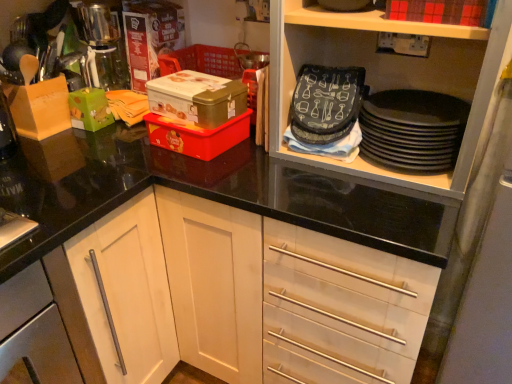
What is the approximate height of metallic gold box at center, which is counted as the second box, starting from the left?

It is 3.53 inches.

Identify the location of black matte plates at upper right. (412, 129).

Identify the location of silver metallic cabinet handle at lower left. (34, 331).

What do you see at coordinates (438, 11) in the screenshot?
I see `red matte box at upper right, which is the first box in right-to-left order` at bounding box center [438, 11].

The width and height of the screenshot is (512, 384). Find the location of `green matte box at left, which is the first box in left-to-right order`. green matte box at left, which is the first box in left-to-right order is located at coordinates (90, 109).

Can you confirm if red plastic container at center, the second box in the right-to-left sequence, is wider than green matte box at left, which ranks as the fourth box in right-to-left order?

Indeed, red plastic container at center, the second box in the right-to-left sequence, has a greater width compared to green matte box at left, which ranks as the fourth box in right-to-left order.

Would you say red plastic container at center, placed as the 3th box when sorted from left to right, contains green matte box at left, which is the first box in left-to-right order?

No, red plastic container at center, placed as the 3th box when sorted from left to right, does not contain green matte box at left, which is the first box in left-to-right order.

Is red plastic container at center, the second box in the right-to-left sequence, positioned far away from green matte box at left, which ranks as the fourth box in right-to-left order?

No, red plastic container at center, the second box in the right-to-left sequence, is not far away from green matte box at left, which ranks as the fourth box in right-to-left order.

From a real-world perspective, is red plastic container at center, the second box in the right-to-left sequence, physically located above or below green matte box at left, which ranks as the fourth box in right-to-left order?

In terms of real-world spatial position, red plastic container at center, the second box in the right-to-left sequence, is below green matte box at left, which ranks as the fourth box in right-to-left order.

Based on the photo, is metallic gold box at center, which is the third box in right-to-left order, directly adjacent to red plastic container at center, placed as the 3th box when sorted from left to right?

Yes, metallic gold box at center, which is the third box in right-to-left order, is right next to red plastic container at center, placed as the 3th box when sorted from left to right, and making contact.

Considering the positions of points (229, 97) and (161, 142), is point (229, 97) closer to camera compared to point (161, 142)?

Yes.

The image size is (512, 384). I want to click on the 2nd box above the red plastic container at center, placed as the 3th box when sorted from left to right (from a real-world perspective), so click(197, 98).

How much distance is there between metallic gold box at center, which is the third box in right-to-left order, and red plastic container at center, the second box in the right-to-left sequence?

6.49 centimeters.

Which point is more forward, (84,10) or (38,327)?

The point (38,327) is more forward.

Who is bigger, brushed metal coffee machine at upper left or silver metallic cabinet handle at lower left?

silver metallic cabinet handle at lower left.

Locate an element on the screen. This screenshot has width=512, height=384. cabinetry that is under the brushed metal coffee machine at upper left (from a real-world perspective) is located at coordinates (34, 331).

Is red plastic container at center, placed as the 3th box when sorted from left to right, shorter than brushed metal coffee machine at upper left?

Indeed, red plastic container at center, placed as the 3th box when sorted from left to right, has a lesser height compared to brushed metal coffee machine at upper left.

Considering the positions of objects red plastic container at center, placed as the 3th box when sorted from left to right, and brushed metal coffee machine at upper left in the image provided, who is more to the left, red plastic container at center, placed as the 3th box when sorted from left to right, or brushed metal coffee machine at upper left?

Positioned to the left is brushed metal coffee machine at upper left.

You are a GUI agent. You are given a task and a screenshot of the screen. Output one action in this format:
    pyautogui.click(x=<x>, y=<y>)
    Task: Click on the coffee machine on the left side of red plastic container at center, placed as the 3th box when sorted from left to right
    The width and height of the screenshot is (512, 384).
    Given the screenshot: What is the action you would take?
    102,43

Is red plastic container at center, placed as the 3th box when sorted from left to right, completely or partially outside of brushed metal coffee machine at upper left?

red plastic container at center, placed as the 3th box when sorted from left to right, lies outside brushed metal coffee machine at upper left's area.

Which of these two, green matte box at left, which is the first box in left-to-right order, or red plastic container at center, the second box in the right-to-left sequence, is bigger?

red plastic container at center, the second box in the right-to-left sequence.

Would you say red plastic container at center, placed as the 3th box when sorted from left to right, is part of green matte box at left, which ranks as the fourth box in right-to-left order,'s contents?

No, green matte box at left, which ranks as the fourth box in right-to-left order, does not contain red plastic container at center, placed as the 3th box when sorted from left to right.

Locate an element on the screen. the 2nd box to the right of the green matte box at left, which is the first box in left-to-right order, counting from the anchor's position is located at coordinates (197, 135).

Is black matte plates at upper right located outside red matte box at upper right, which is the first box in right-to-left order?

Yes, black matte plates at upper right is located beyond the bounds of red matte box at upper right, which is the first box in right-to-left order.

Consider the image. Looking at the image, does black matte plates at upper right seem bigger or smaller compared to red matte box at upper right, which is the first box in right-to-left order?

Clearly, black matte plates at upper right is larger in size than red matte box at upper right, which is the first box in right-to-left order.

Is black matte plates at upper right looking in the opposite direction of red matte box at upper right, which is counted as the 4th box, starting from the left?

No, red matte box at upper right, which is counted as the 4th box, starting from the left, is not at the back of black matte plates at upper right.

From the image's perspective, is black matte plates at upper right located beneath red matte box at upper right, which is counted as the 4th box, starting from the left?

Indeed, from the image's perspective, black matte plates at upper right is shown beneath red matte box at upper right, which is counted as the 4th box, starting from the left.

Considering the relative sizes of metallic gold box at center, which is counted as the second box, starting from the left, and silver metallic cabinet handle at lower left in the image provided, is metallic gold box at center, which is counted as the second box, starting from the left, smaller than silver metallic cabinet handle at lower left?

Yes.

Considering the relative positions of metallic gold box at center, which is the third box in right-to-left order, and silver metallic cabinet handle at lower left in the image provided, is metallic gold box at center, which is the third box in right-to-left order, behind silver metallic cabinet handle at lower left?

That is True.

From the image's perspective, who appears lower, metallic gold box at center, which is the third box in right-to-left order, or silver metallic cabinet handle at lower left?

silver metallic cabinet handle at lower left, from the image's perspective.

What's the angular difference between metallic gold box at center, which is counted as the second box, starting from the left, and silver metallic cabinet handle at lower left's facing directions?

The angle between the facing direction of metallic gold box at center, which is counted as the second box, starting from the left, and the facing direction of silver metallic cabinet handle at lower left is 87.2 degrees.

At what (x,y) coordinates should I click in order to perform the action: click on box behind the red plastic container at center, the second box in the right-to-left sequence. Please return your answer as a coordinate pair (x, y). The height and width of the screenshot is (384, 512). Looking at the image, I should click on (90, 109).

Locate an element on the screen. the 1st box counting from the right of the metallic gold box at center, which is counted as the second box, starting from the left is located at coordinates (197, 135).

Which object lies further to the anchor point brushed metal coffee machine at upper left, red plastic container at center, the second box in the right-to-left sequence, or green matte box at left, which is the first box in left-to-right order?

Based on the image, red plastic container at center, the second box in the right-to-left sequence, appears to be further to brushed metal coffee machine at upper left.

Which object lies nearer to the anchor point black matte plates at upper right, brushed metal coffee machine at upper left or green matte box at left, which ranks as the fourth box in right-to-left order?

The object closer to black matte plates at upper right is green matte box at left, which ranks as the fourth box in right-to-left order.

Based on their spatial positions, is red matte box at upper right, which is the first box in right-to-left order, or black matte plates at upper right closer to green matte box at left, which is the first box in left-to-right order?

black matte plates at upper right is positioned closer to the anchor green matte box at left, which is the first box in left-to-right order.

From the picture: From the image, which object appears to be farther from red matte box at upper right, which is counted as the 4th box, starting from the left, metallic gold box at center, which is counted as the second box, starting from the left, or silver metallic cabinet handle at lower left?

silver metallic cabinet handle at lower left lies further to red matte box at upper right, which is counted as the 4th box, starting from the left, than the other object.

Based on their spatial positions, is metallic gold box at center, which is the third box in right-to-left order, or red plastic container at center, the second box in the right-to-left sequence, closer to brushed metal coffee machine at upper left?

metallic gold box at center, which is the third box in right-to-left order, is closer to brushed metal coffee machine at upper left.

Estimate the real-world distances between objects in this image. Which object is closer to red plastic container at center, placed as the 3th box when sorted from left to right, silver metallic cabinet handle at lower left or brushed metal coffee machine at upper left?

Based on the image, brushed metal coffee machine at upper left appears to be nearer to red plastic container at center, placed as the 3th box when sorted from left to right.

From the image, which object appears to be farther from red matte box at upper right, which is the first box in right-to-left order, silver metallic cabinet handle at lower left or brushed metal coffee machine at upper left?

Among the two, silver metallic cabinet handle at lower left is located further to red matte box at upper right, which is the first box in right-to-left order.

From the image, which object appears to be farther from silver metallic cabinet handle at lower left, green matte box at left, which ranks as the fourth box in right-to-left order, or metallic gold box at center, which is counted as the second box, starting from the left?

The object further to silver metallic cabinet handle at lower left is green matte box at left, which ranks as the fourth box in right-to-left order.

In order to click on coffee machine between silver metallic cabinet handle at lower left and black matte plates at upper right in this screenshot , I will do `click(102, 43)`.

Identify the location of appliance located between brushed metal coffee machine at upper left and red matte box at upper right, which is counted as the 4th box, starting from the left, in the left-right direction. (412, 129).

Where is `appliance between silver metallic cabinet handle at lower left and red matte box at upper right, which is the first box in right-to-left order, in the horizontal direction`? This screenshot has height=384, width=512. appliance between silver metallic cabinet handle at lower left and red matte box at upper right, which is the first box in right-to-left order, in the horizontal direction is located at coordinates (412, 129).

You are a GUI agent. You are given a task and a screenshot of the screen. Output one action in this format:
    pyautogui.click(x=<x>, y=<y>)
    Task: Click on the box between green matte box at left, which ranks as the fourth box in right-to-left order, and silver metallic cabinet handle at lower left, in the vertical direction
    Image resolution: width=512 pixels, height=384 pixels.
    Given the screenshot: What is the action you would take?
    pyautogui.click(x=197, y=135)